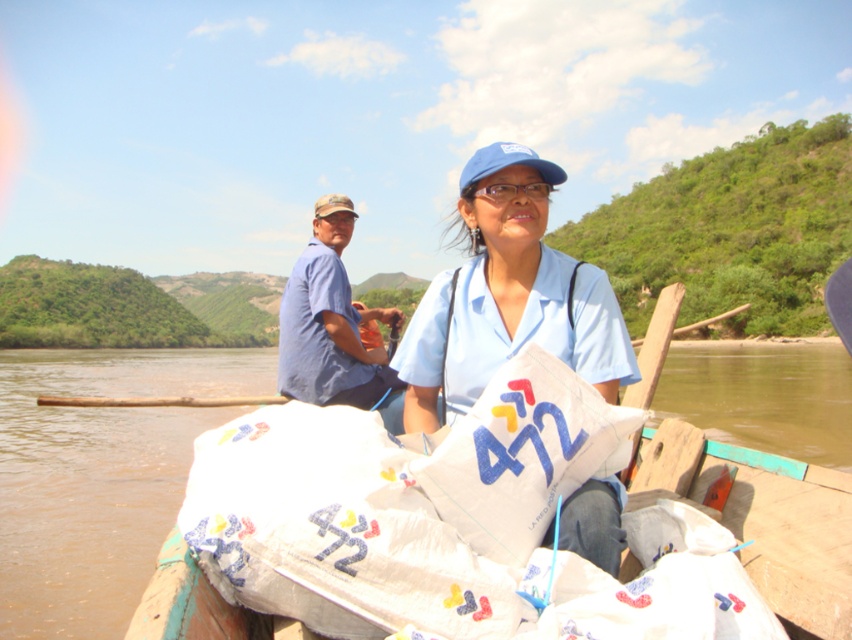
In the scene shown: Between blue fabric shirt at center and blue cotton shirt at center, which one appears on the right side from the viewer's perspective?

From the viewer's perspective, blue fabric shirt at center appears more on the right side.

Who is positioned more to the left, blue fabric shirt at center or blue cotton shirt at center?

From the viewer's perspective, blue cotton shirt at center appears more on the left side.

Between point (537, 193) and point (301, 291), which one is positioned in front?

Point (537, 193)

Where is `blue fabric shirt at center`? This screenshot has width=852, height=640. blue fabric shirt at center is located at coordinates (507, 296).

Who is taller, blue fabric shirt at center or white fabric bags at center?

blue fabric shirt at center is taller.

Is point (547, 348) positioned in front of point (689, 458)?

Yes, it is.

Who is more distant from viewer, [626,336] or [239,628]?

Point [626,336]

The image size is (852, 640). Find the location of `blue fabric shirt at center`. blue fabric shirt at center is located at coordinates (507, 296).

The height and width of the screenshot is (640, 852). What do you see at coordinates (772, 522) in the screenshot? I see `white fabric bags at center` at bounding box center [772, 522].

In the scene shown: Does white fabric bags at center come behind blue cotton shirt at center?

No.

Between point (131, 401) and point (304, 296), which one is positioned behind?

Point (131, 401)

Where is `white fabric bags at center`? white fabric bags at center is located at coordinates (772, 522).